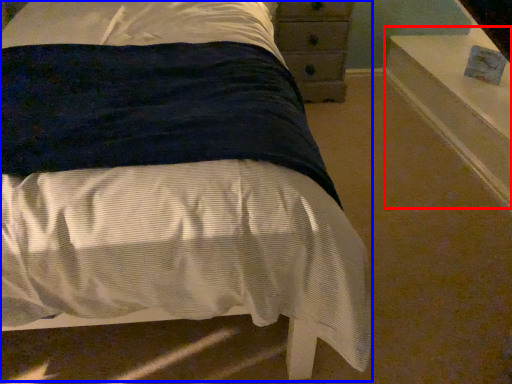
Question: Among these objects, which one is nearest to the camera, window sill (highlighted by a red box) or bed (highlighted by a blue box)?

Choices:
 (A) window sill
 (B) bed

Answer: (B)